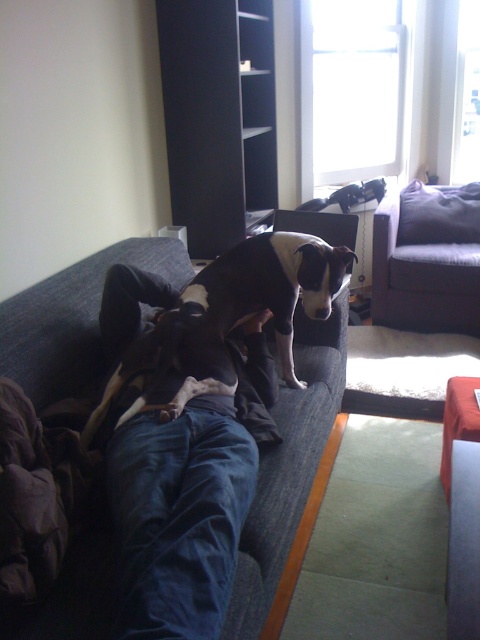
Can you confirm if blue fabric couch at upper center is bigger than black and white fur dog at center?

Indeed, blue fabric couch at upper center has a larger size compared to black and white fur dog at center.

Between blue fabric couch at upper center and black and white fur dog at center, which one is positioned lower?

blue fabric couch at upper center is below.

Which is in front, point (142, 467) or point (204, 284)?

Point (142, 467)

The image size is (480, 640). Find the location of `blue fabric couch at upper center`. blue fabric couch at upper center is located at coordinates (153, 532).

Is point (136, 392) positioned before point (466, 218)?

Yes, it is in front of point (466, 218).

Does blue fabric couch at upper center have a greater width compared to dark gray fabric couch at upper right?

Yes, blue fabric couch at upper center is wider than dark gray fabric couch at upper right.

Between point (23, 627) and point (441, 317), which one is positioned in front?

Positioned in front is point (23, 627).

The height and width of the screenshot is (640, 480). In order to click on blue fabric couch at upper center in this screenshot , I will do `click(153, 532)`.

Does black and white fur dog at center have a lesser width compared to dark gray fabric couch at upper right?

No.

Consider the image. Who is more forward, (200, 296) or (391, 228)?

Point (200, 296) is more forward.

At what (x,y) coordinates should I click in order to perform the action: click on black and white fur dog at center. Please return your answer as a coordinate pair (x, y). Looking at the image, I should click on (228, 321).